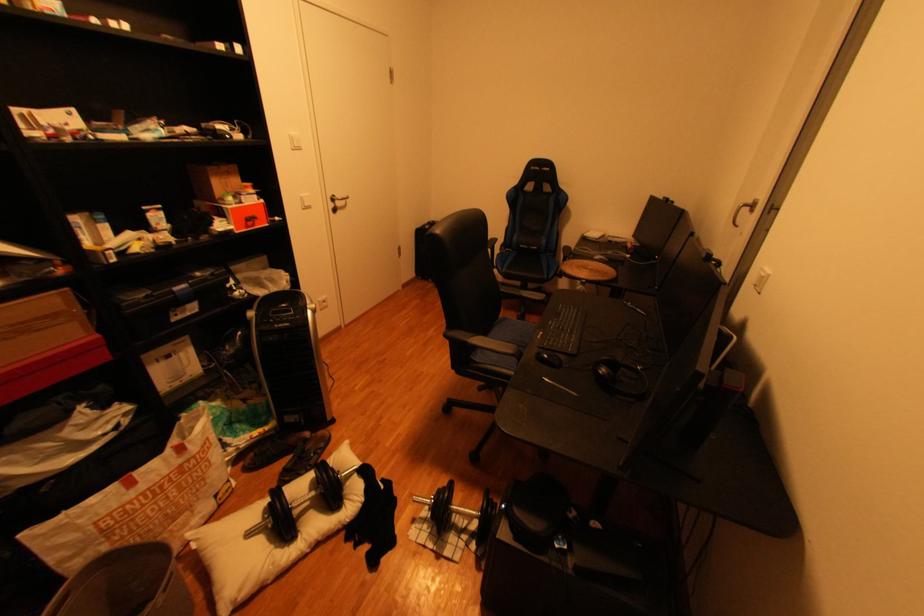
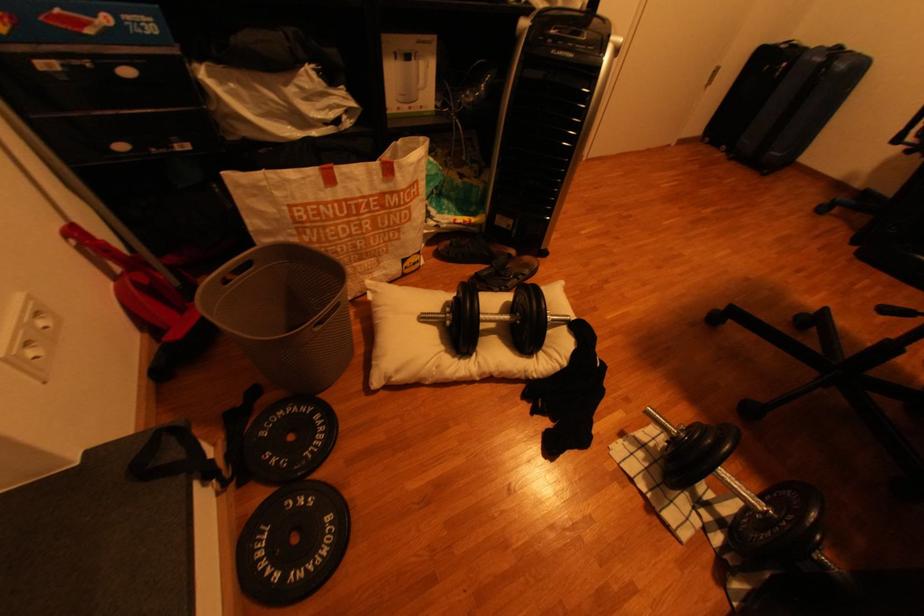
The point at (259,535) is marked in the first image. Where is the corresponding point in the second image?

(433, 318)